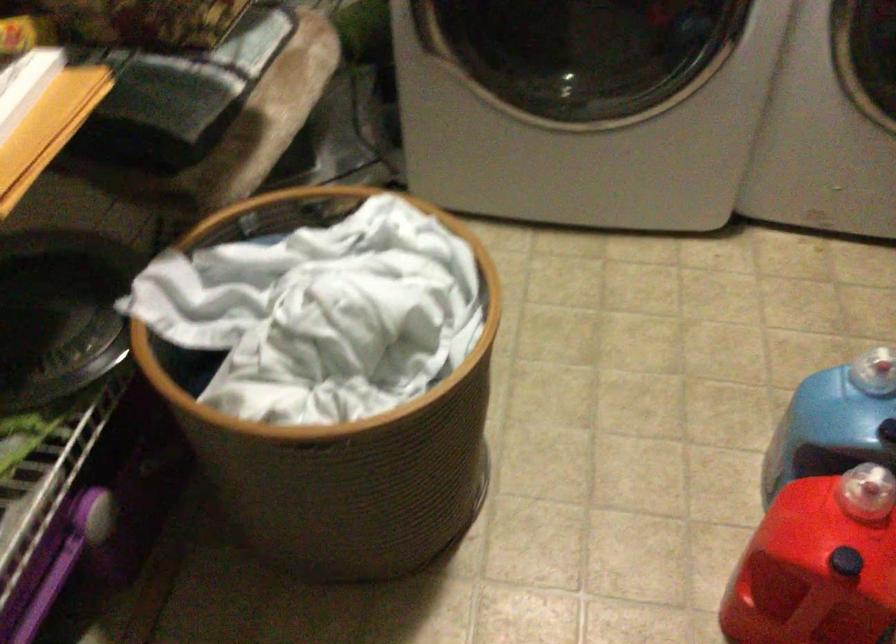
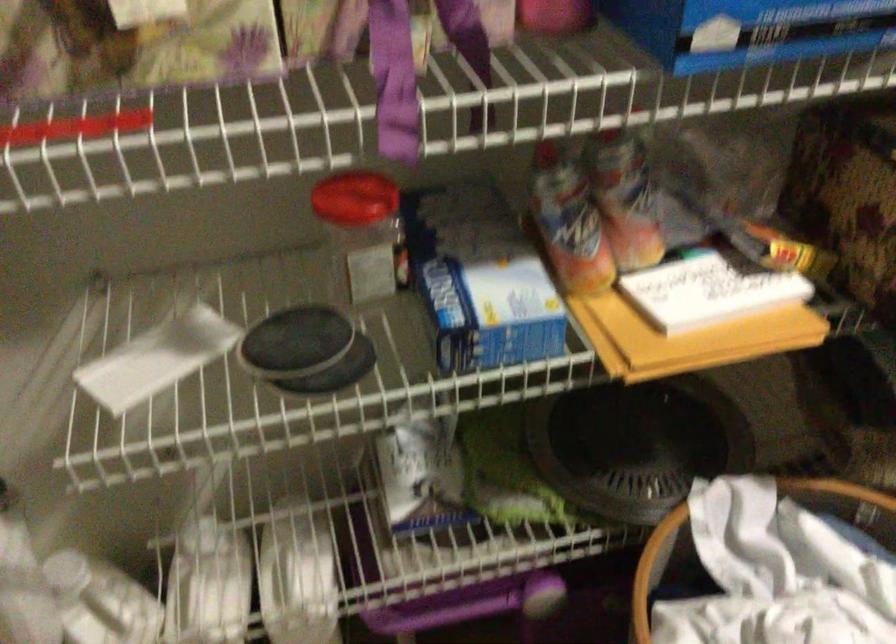
Question: Based on the continuous images, in which direction is the camera rotating? Reply with the corresponding letter.

Choices:
 (A) Left
 (B) Right
 (C) Up
 (D) Down

Answer: (A)